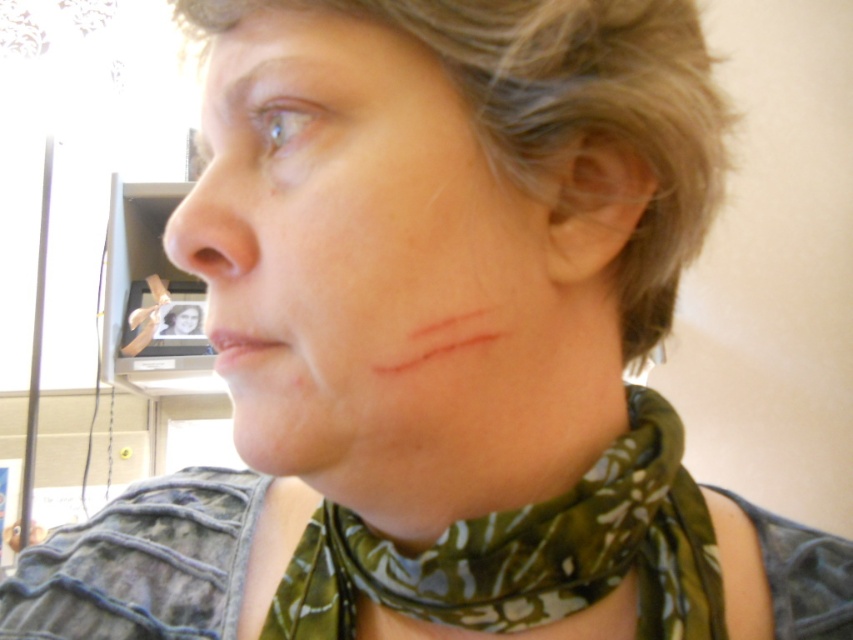
Is the position of skin at center less distant than that of matte skin nose at center?

That is True.

Between skin at center and matte skin nose at center, which one has more height?

Standing taller between the two is skin at center.

Does point (534, 339) come in front of point (241, 224)?

No, it is not.

The width and height of the screenshot is (853, 640). Identify the location of skin at center. (469, 401).

Who is positioned more to the right, green printed fabric scarf at lower center or matte skin nose at center?

Positioned to the right is green printed fabric scarf at lower center.

Measure the distance between green printed fabric scarf at lower center and camera.

They are 11.17 inches apart.

Locate an element on the screen. green printed fabric scarf at lower center is located at coordinates (529, 554).

Which is below, skin at center or green printed fabric scarf at lower center?

green printed fabric scarf at lower center

Between point (352, 374) and point (680, 476), which one is positioned behind?

The point (680, 476) is more distant.

Image resolution: width=853 pixels, height=640 pixels. In order to click on skin at center in this screenshot , I will do `click(469, 401)`.